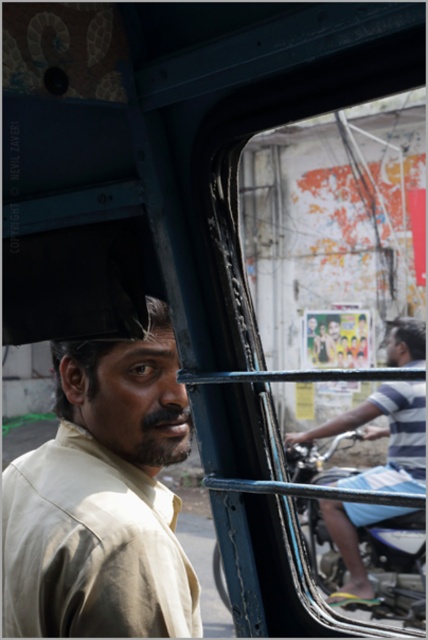
You are standing inside the vehicle and want to reach out to touch the point at coordinate point (x=121, y=627) on the window. If your arm can extend 1.1 meters, will you be able to reach it?

The point at coordinate point (x=121, y=627) is 1.13 meters away from you, so your arm can only extend 1.1 meters. Therefore, you cannot reach the point at coordinate point (x=121, y=627).

You are standing on the sidewalk outside the vehicle and want to hand a flyer to the person wearing the beige fabric shirt at left. Can you reach them without entering the vehicle?

The beige fabric shirt at left is 1.11 meters away from the viewer. Since you are outside the vehicle, the distance may be too far to reach comfortably without entering, so it might not be possible to hand the flyer without getting closer.

You are a tailor who needs to determine which shirt requires more fabric for alterations. Based on the scene, which shirt between the beige fabric shirt at left and the striped fabric shirt at right would need more fabric due to its larger size?

The striped fabric shirt at right requires more fabric for alterations because it has a greater width compared to the beige fabric shirt at left.